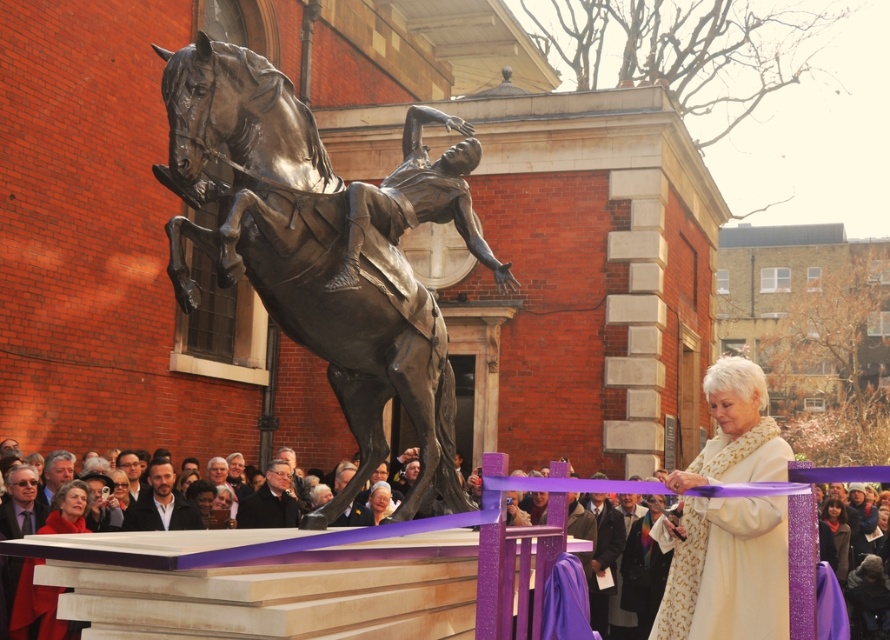
You are standing at the center of the image. Looking towards the bronze statue at center, which direction should you move to get closer to it?

Since the bronze statue at center is located at point (300, 256) in the image, you are already at the center, so you don not need to move in any direction to get closer to it. You are already facing the bronze statue at center.

You are attending the unveiling event and want to take a photo of the statue. The statue has two notable features in the foreground. Which feature will appear larger in your photo? The smooth black suit at center or the smooth brown hair at center?

The smooth black suit at center will appear larger in your photo because it is closer to the viewer than the smooth brown hair at center.